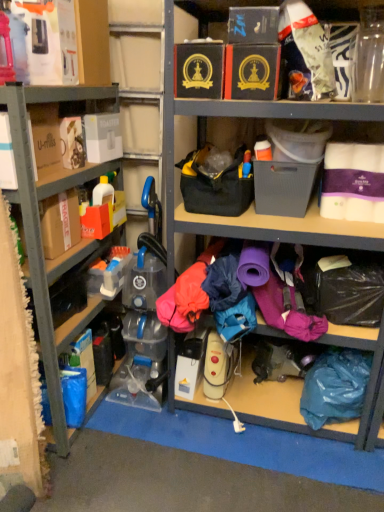
This screenshot has height=512, width=384. What do you see at coordinates (251, 72) in the screenshot?
I see `matte black box at upper center, marked as the 4th storage box in a left-to-right arrangement` at bounding box center [251, 72].

The height and width of the screenshot is (512, 384). Describe the element at coordinates (103, 137) in the screenshot. I see `white cardboard toaster at upper left, placed as the fifth storage box when sorted from right to left` at that location.

Describe the element at coordinates (283, 187) in the screenshot. The width and height of the screenshot is (384, 512). I see `gray plastic storage box at center, the 5th storage box when ordered from left to right` at that location.

What do you see at coordinates (199, 70) in the screenshot? I see `black leather book at upper center, which is the fourth storage box from right to left` at bounding box center [199, 70].

How much space does black leather book at upper center, arranged as the 2th storage box when viewed from the left, occupy vertically?

18.51 centimeters.

The width and height of the screenshot is (384, 512). In order to click on matte plastic container at left in this screenshot , I will do `click(38, 220)`.

Where is `matte black box at upper center, which appears as the 2th storage box when viewed from the right`? The height and width of the screenshot is (512, 384). matte black box at upper center, which appears as the 2th storage box when viewed from the right is located at coordinates (251, 72).

Is black leather book at upper center, which is the fourth storage box from right to left, shorter than gray plastic storage box at center, which is counted as the first storage box, starting from the right?

Indeed, black leather book at upper center, which is the fourth storage box from right to left, has a lesser height compared to gray plastic storage box at center, which is counted as the first storage box, starting from the right.

Which of these two, black leather book at upper center, which is the fourth storage box from right to left, or gray plastic storage box at center, the 5th storage box when ordered from left to right, is smaller?

black leather book at upper center, which is the fourth storage box from right to left, is smaller.

What's the angular difference between black leather book at upper center, which is the fourth storage box from right to left, and gray plastic storage box at center, which is counted as the first storage box, starting from the right,'s facing directions?

0.28 degrees separate the facing orientations of black leather book at upper center, which is the fourth storage box from right to left, and gray plastic storage box at center, which is counted as the first storage box, starting from the right.

From the image's perspective, is black leather book at upper center, arranged as the 2th storage box when viewed from the left, above gray plastic storage box at center, the 5th storage box when ordered from left to right?

Yes, from the image's perspective, black leather book at upper center, arranged as the 2th storage box when viewed from the left, is on top of gray plastic storage box at center, the 5th storage box when ordered from left to right.

At what (x,y) coordinates should I click in order to perform the action: click on clothing on the right of the white cardboard toaster at upper left, placed as the fifth storage box when sorted from right to left. Please return your answer as a coordinate pair (x, y). The width and height of the screenshot is (384, 512). Looking at the image, I should click on (335, 386).

Would you say teal fabric bag at lower right is to the left or to the right of white cardboard toaster at upper left, placed as the fifth storage box when sorted from right to left, in the picture?

Based on their positions, teal fabric bag at lower right is located to the right of white cardboard toaster at upper left, placed as the fifth storage box when sorted from right to left.

From the picture: From a real-world perspective, is teal fabric bag at lower right positioned under white cardboard toaster at upper left, placed as the fifth storage box when sorted from right to left, based on gravity?

Yes, from a real-world perspective, teal fabric bag at lower right is under white cardboard toaster at upper left, placed as the fifth storage box when sorted from right to left.

Measure the distance between teal fabric bag at lower right and white cardboard toaster at upper left, placed as the fifth storage box when sorted from right to left.

teal fabric bag at lower right and white cardboard toaster at upper left, placed as the fifth storage box when sorted from right to left, are 4.63 feet apart from each other.

Which is more to the right, black leather book at upper center, which is the fourth storage box from right to left, or white cardboard toaster at upper left, placed as the fifth storage box when sorted from right to left?

black leather book at upper center, which is the fourth storage box from right to left.

Is point (188, 93) farther from viewer compared to point (103, 118)?

No, it is not.

Considering the sizes of objects black leather book at upper center, which is the fourth storage box from right to left, and white cardboard toaster at upper left, placed as the fifth storage box when sorted from right to left, in the image provided, who is taller, black leather book at upper center, which is the fourth storage box from right to left, or white cardboard toaster at upper left, placed as the fifth storage box when sorted from right to left,?

white cardboard toaster at upper left, placed as the fifth storage box when sorted from right to left, is taller.

From a real-world perspective, which object rests below the other?

white cardboard toaster at upper left, which is counted as the 1th storage box, starting from the left.

Does point (244, 88) come behind point (106, 155)?

That is False.

Considering the sizes of objects matte black box at upper center, marked as the 4th storage box in a left-to-right arrangement, and white cardboard toaster at upper left, placed as the fifth storage box when sorted from right to left, in the image provided, who is smaller, matte black box at upper center, marked as the 4th storage box in a left-to-right arrangement, or white cardboard toaster at upper left, placed as the fifth storage box when sorted from right to left,?

white cardboard toaster at upper left, placed as the fifth storage box when sorted from right to left, is smaller.

Is black leather book at upper center, arranged as the 2th storage box when viewed from the left, inside the boundaries of matte plastic container at left, or outside?

The correct answer is: outside.

How different are the orientations of black leather book at upper center, arranged as the 2th storage box when viewed from the left, and matte plastic container at left in degrees?

The angular difference between black leather book at upper center, arranged as the 2th storage box when viewed from the left, and matte plastic container at left is 89 degrees.

Measure the distance from black leather book at upper center, arranged as the 2th storage box when viewed from the left, to matte plastic container at left.

They are 23.56 inches apart.

Are black leather book at upper center, which is the fourth storage box from right to left, and matte plastic container at left located far from each other?

No, there isn't a large distance between black leather book at upper center, which is the fourth storage box from right to left, and matte plastic container at left.

Considering the relative sizes of matte plastic container at left and matte black box at upper center, which appears as the 2th storage box when viewed from the right, in the image provided, is matte plastic container at left bigger than matte black box at upper center, which appears as the 2th storage box when viewed from the right,?

Indeed, matte plastic container at left has a larger size compared to matte black box at upper center, which appears as the 2th storage box when viewed from the right.

From the image's perspective, is matte plastic container at left positioned above or below matte black box at upper center, which appears as the 2th storage box when viewed from the right?

Clearly, from the image's perspective, matte plastic container at left is below matte black box at upper center, which appears as the 2th storage box when viewed from the right.

Does matte plastic container at left turn towards matte black box at upper center, which appears as the 2th storage box when viewed from the right?

Yes, matte plastic container at left faces towards matte black box at upper center, which appears as the 2th storage box when viewed from the right.

Considering the relative sizes of matte plastic container at left and matte black box at upper center, which appears as the 2th storage box when viewed from the right, in the image provided, is matte plastic container at left taller than matte black box at upper center, which appears as the 2th storage box when viewed from the right,?

Correct, matte plastic container at left is much taller as matte black box at upper center, which appears as the 2th storage box when viewed from the right.

From the image's perspective, between teal fabric bag at lower right and matte plastic container at left, who is located below?

teal fabric bag at lower right appears lower in the image.

Is teal fabric bag at lower right placed right next to matte plastic container at left?

They are not placed beside each other.

I want to click on clothing on the right of matte plastic container at left, so click(335, 386).

Can you confirm if teal fabric bag at lower right is bigger than matte plastic container at left?

Actually, teal fabric bag at lower right might be smaller than matte plastic container at left.

Where is `the 3rd storage box above when counting from the gray plastic storage box at center, which is counted as the first storage box, starting from the right (from the image's perspective)`? This screenshot has width=384, height=512. the 3rd storage box above when counting from the gray plastic storage box at center, which is counted as the first storage box, starting from the right (from the image's perspective) is located at coordinates (199, 70).

I want to click on clothing below the white cardboard toaster at upper left, placed as the fifth storage box when sorted from right to left (from the image's perspective), so click(335, 386).

When comparing their distances from black leather book at upper center, arranged as the 2th storage box when viewed from the left, does matte black box at upper center, marked as the 4th storage box in a left-to-right arrangement, or black cardboard box at upper center, arranged as the 3th storage box when viewed from the right, seem closer?

matte black box at upper center, marked as the 4th storage box in a left-to-right arrangement, is closer to black leather book at upper center, arranged as the 2th storage box when viewed from the left.

Which object lies further to the anchor point matte black box at upper center, marked as the 4th storage box in a left-to-right arrangement, black leather book at upper center, which is the fourth storage box from right to left, or black cardboard box at upper center, arranged as the 3th storage box when viewed from the right?

The object further to matte black box at upper center, marked as the 4th storage box in a left-to-right arrangement, is black leather book at upper center, which is the fourth storage box from right to left.

Which object lies further to the anchor point matte plastic container at left, black leather book at upper center, arranged as the 2th storage box when viewed from the left, or teal fabric bag at lower right?

teal fabric bag at lower right is further to matte plastic container at left.

Considering their positions, is white cardboard toaster at upper left, which is counted as the 1th storage box, starting from the left, positioned further to matte black box at upper center, marked as the 4th storage box in a left-to-right arrangement, than matte plastic container at left?

matte plastic container at left.

Considering their positions, is white cardboard toaster at upper left, placed as the fifth storage box when sorted from right to left, positioned closer to black leather book at upper center, which is the fourth storage box from right to left, than gray plastic storage box at center, which is counted as the first storage box, starting from the right?

gray plastic storage box at center, which is counted as the first storage box, starting from the right, is positioned closer to the anchor black leather book at upper center, which is the fourth storage box from right to left.

Looking at the image, which one is located further to black leather book at upper center, which is the fourth storage box from right to left, matte black box at upper center, marked as the 4th storage box in a left-to-right arrangement, or matte plastic container at left?

The object further to black leather book at upper center, which is the fourth storage box from right to left, is matte plastic container at left.

Considering their positions, is gray plastic storage box at center, the 5th storage box when ordered from left to right, positioned further to matte black box at upper center, which appears as the 2th storage box when viewed from the right, than white cardboard toaster at upper left, which is counted as the 1th storage box, starting from the left?

The object further to matte black box at upper center, which appears as the 2th storage box when viewed from the right, is white cardboard toaster at upper left, which is counted as the 1th storage box, starting from the left.

Based on their spatial positions, is matte black box at upper center, marked as the 4th storage box in a left-to-right arrangement, or black leather book at upper center, which is the fourth storage box from right to left, closer to matte plastic container at left?

The object closer to matte plastic container at left is black leather book at upper center, which is the fourth storage box from right to left.

This screenshot has width=384, height=512. Identify the location of storage box located between black leather book at upper center, which is the fourth storage box from right to left, and matte black box at upper center, which appears as the 2th storage box when viewed from the right, in the left-right direction. (253, 25).

The width and height of the screenshot is (384, 512). Identify the location of shelf between black leather book at upper center, which is the fourth storage box from right to left, and teal fabric bag at lower right, in the vertical direction. (38, 220).

Locate an element on the screen. storage box located between white cardboard toaster at upper left, which is counted as the 1th storage box, starting from the left, and black cardboard box at upper center, placed as the 3th storage box when sorted from left to right, in the left-right direction is located at coordinates (199, 70).

Where is `storage box between white cardboard toaster at upper left, which is counted as the 1th storage box, starting from the left, and teal fabric bag at lower right, in the vertical direction`? The height and width of the screenshot is (512, 384). storage box between white cardboard toaster at upper left, which is counted as the 1th storage box, starting from the left, and teal fabric bag at lower right, in the vertical direction is located at coordinates (283, 187).